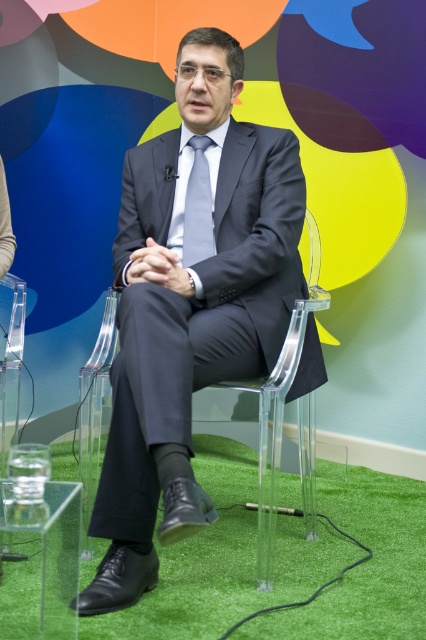
Which is above, matte plastic chair at center or matte black suit at center?

matte plastic chair at center is higher up.

Is point (25, 388) farther from camera compared to point (190, 308)?

Yes, point (25, 388) is behind point (190, 308).

Who is more distant from viewer, (63, 120) or (167, 218)?

Point (63, 120)

Find the location of a particular element. Image resolution: width=426 pixels, height=640 pixels. matte plastic chair at center is located at coordinates (241, 120).

Between matte plastic chair at center and matte gray tie at center, which one has less height?

With less height is matte gray tie at center.

Is matte plastic chair at center closer to the viewer compared to matte gray tie at center?

No, matte plastic chair at center is further to the viewer.

Who is more forward, (419, 77) or (199, 200)?

Point (199, 200)

The width and height of the screenshot is (426, 640). What are the coordinates of `matte plastic chair at center` in the screenshot? It's located at (241, 120).

Is matte black suit at center above matte gray tie at center?

Incorrect, matte black suit at center is not positioned above matte gray tie at center.

Who is more distant from viewer, (x=204, y=49) or (x=203, y=154)?

Point (x=203, y=154)

Which is behind, point (233, 221) or point (207, 218)?

Point (207, 218)

You are a GUI agent. You are given a task and a screenshot of the screen. Output one action in this format:
    pyautogui.click(x=<x>, y=<y>)
    Task: Click on the matte black suit at center
    The image size is (426, 640).
    Given the screenshot: What is the action you would take?
    pyautogui.click(x=189, y=307)